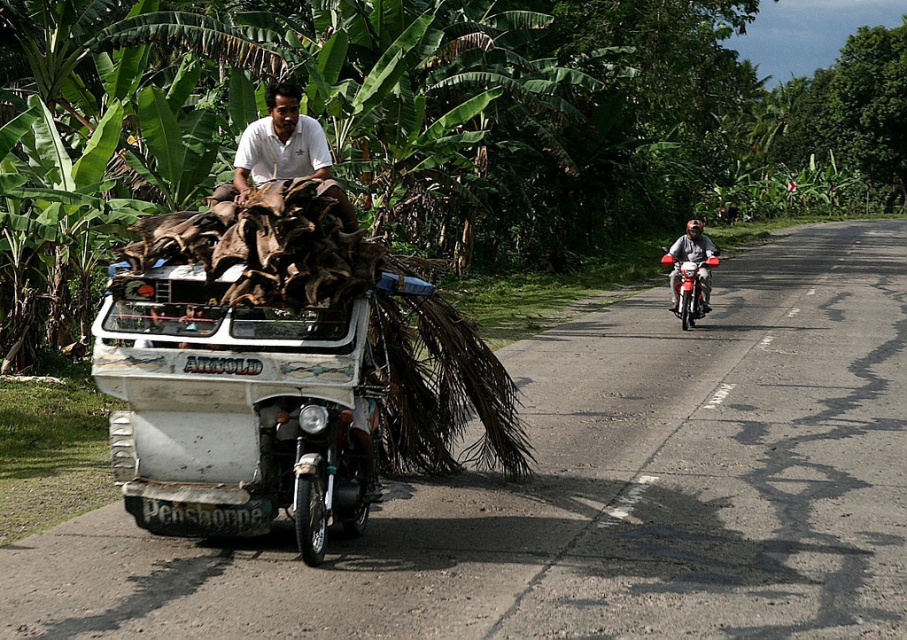
Question: Which object appears farthest from the camera in this image?

Choices:
 (A) white painted wood tricycle at center
 (B) red glossy motorcycle at right

Answer: (B)

Question: Is white painted wood tricycle at center closer to camera compared to red glossy motorcycle at right?

Choices:
 (A) no
 (B) yes

Answer: (B)

Question: Among these points, which one is nearest to the camera?

Choices:
 (A) (128, 428)
 (B) (678, 298)

Answer: (A)

Question: Is white painted wood tricycle at center further to the viewer compared to red glossy motorcycle at right?

Choices:
 (A) no
 (B) yes

Answer: (A)

Question: Which object appears closest to the camera in this image?

Choices:
 (A) red glossy motorcycle at right
 (B) white painted wood tricycle at center

Answer: (B)

Question: In this image, where is white painted wood tricycle at center located relative to red glossy motorcycle at right?

Choices:
 (A) left
 (B) right

Answer: (A)